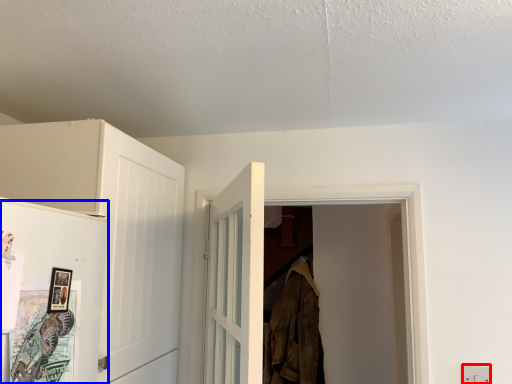
Question: Which of the following is the closest to the observer, electric outlet (highlighted by a red box) or door (highlighted by a blue box)?

Choices:
 (A) electric outlet
 (B) door

Answer: (B)